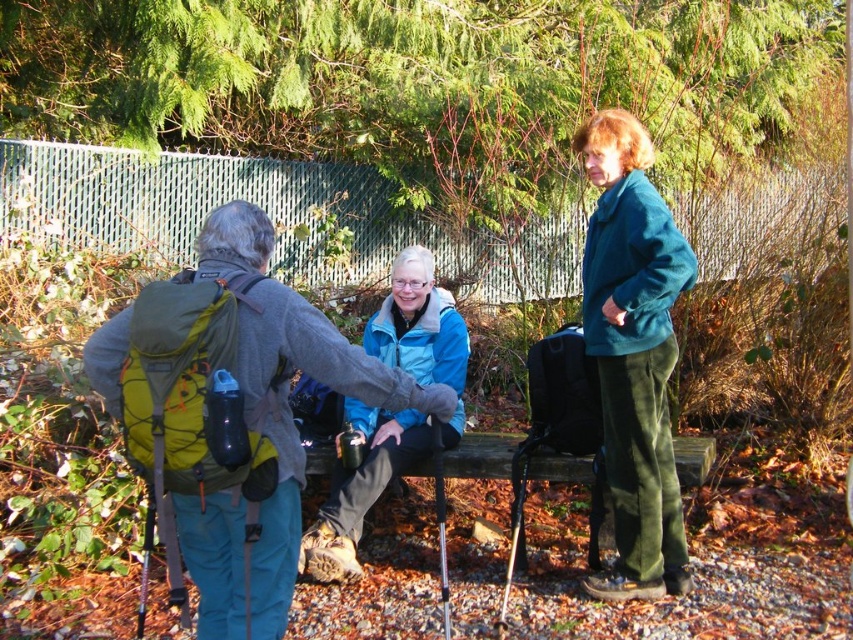
You are a photographer standing in the park and want to take a photo that includes both the teal fleece jacket at upper right and the blue fleece jacket at center. Which jacket will appear larger in the photo?

The teal fleece jacket at upper right will appear larger in the photo because it is much taller than the blue fleece jacket at center.

You are planning to pack your camping gear and see the green fabric backpack at left and the blue fleece jacket at center in the image. Which item has a larger size?

The blue fleece jacket at center is larger than the green fabric backpack at left.

You are standing in a park and want to reach a specific point marked at coordinates point [209,580]. If you can walk 3 meters in 1 minute, how long will it take you to reach that point?

The distance of point [209,580] from viewer is 3.05 meters. Since you walk 3 meters in 1 minute, it will take approximately 1 minute and 1 second to reach the point.